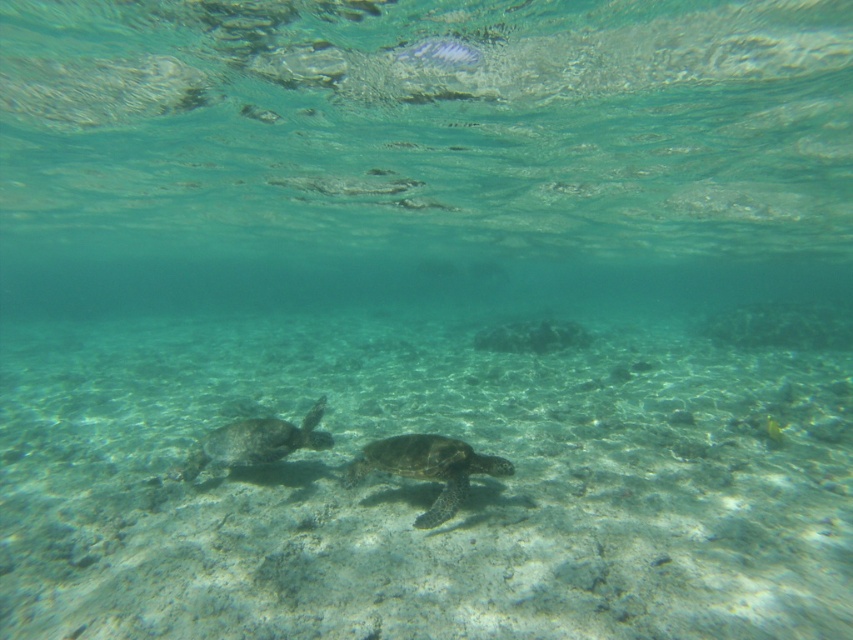
You are a marine biologist observing the underwater scene. You notice the green textured shell at center and the green matte turtle at lower left. Which object has a smaller width?

The green textured shell at center has a lesser width compared to the green matte turtle at lower left.

You are a marine biologist studying the behavior of turtles in this underwater environment. You notice the green textured shell at center and the green matte turtle at lower left. How far apart are these two objects?

The green textured shell at center and the green matte turtle at lower left are 3.43 feet apart from each other.

From the picture: You are a marine biologist observing an underwater scene. You notice the green textured shell at center and the green matte turtle at lower left. Which object is positioned lower in the image?

The green textured shell at center is located below the green matte turtle at lower left, so it is positioned lower in the image.